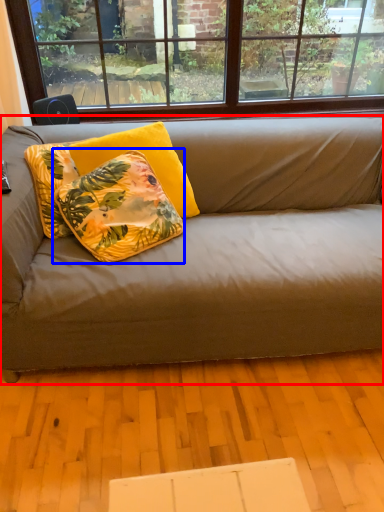
Question: Which object is closer to the camera taking this photo, studio couch (highlighted by a red box) or pillow (highlighted by a blue box)?

Choices:
 (A) studio couch
 (B) pillow

Answer: (A)